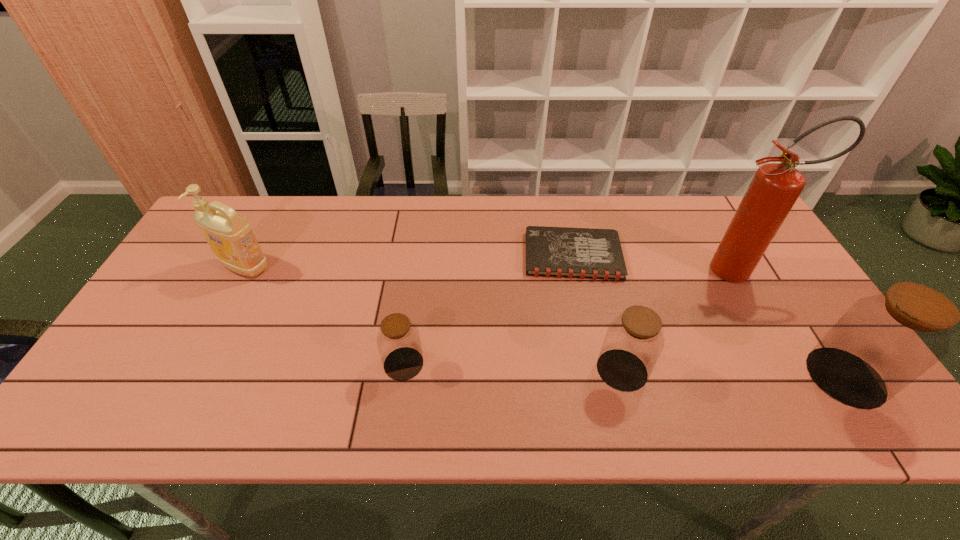
Locate an element on the screen. This screenshot has height=540, width=960. free space between the notebook and the tallest object is located at coordinates (656, 263).

Where is `vacant space that's between the second object from left to right and the notebook`? This screenshot has width=960, height=540. vacant space that's between the second object from left to right and the notebook is located at coordinates (489, 309).

The width and height of the screenshot is (960, 540). What are the coordinates of `free space between the detergent and the fifth tallest object` in the screenshot? It's located at (324, 315).

Find the location of a particular element. Image resolution: width=960 pixels, height=540 pixels. free space between the second shortest object and the tallest object is located at coordinates (571, 317).

You are a GUI agent. You are given a task and a screenshot of the screen. Output one action in this format:
    pyautogui.click(x=<x>, y=<y>)
    Task: Click on the object identified as the second closest to the leftmost object
    The width and height of the screenshot is (960, 540).
    Given the screenshot: What is the action you would take?
    pyautogui.click(x=558, y=252)

Identify the location of object that is the fourth closest to the leftmost jar. (775, 187).

Identify which jar is located as the third nearest to the notebook. Please provide its 2D coordinates. Your answer should be formatted as a tuple, i.e. [(x, y)], where the tuple contains the x and y coordinates of a point satisfying the conditions above.

[(882, 343)]

Point out which jar is positioned as the third nearest to the shortest object. Please provide its 2D coordinates. Your answer should be formatted as a tuple, i.e. [(x, y)], where the tuple contains the x and y coordinates of a point satisfying the conditions above.

[(882, 343)]

This screenshot has width=960, height=540. I want to click on free spot that satisfies the following two spatial constraints: 1. on the front side of the detergent; 2. on the left side of the second jar from left to right, so click(x=191, y=370).

The height and width of the screenshot is (540, 960). I want to click on free space that satisfies the following two spatial constraints: 1. from the nozzle of the rightmost jar; 2. on the right side of the tallest object, so [x=800, y=377].